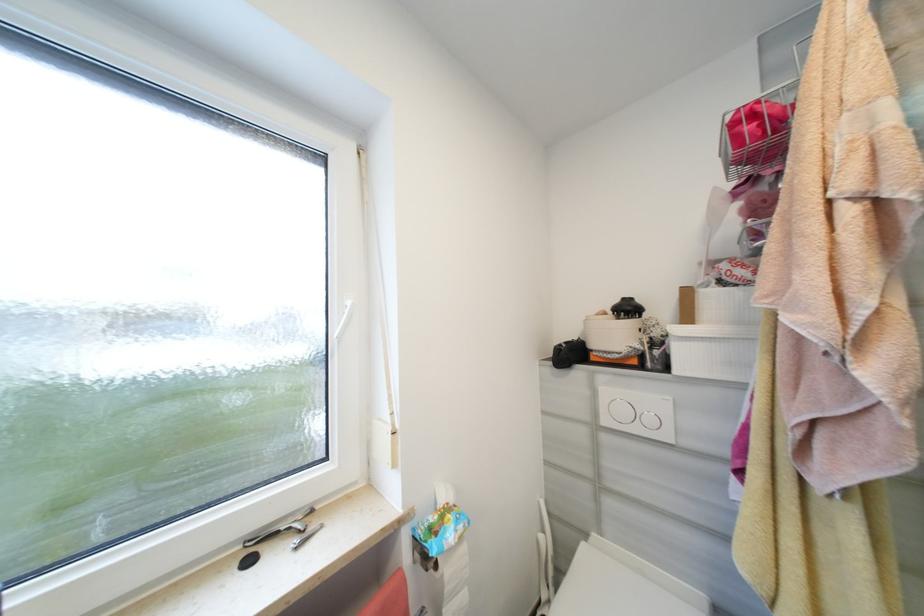
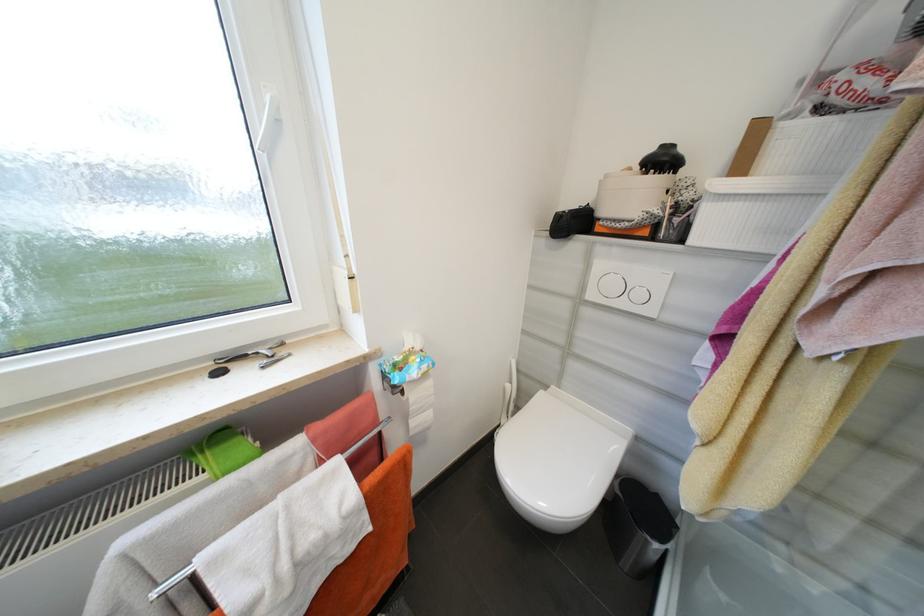
What movement of the cameraman would produce the second image?

The cameraman moved toward right, forward.